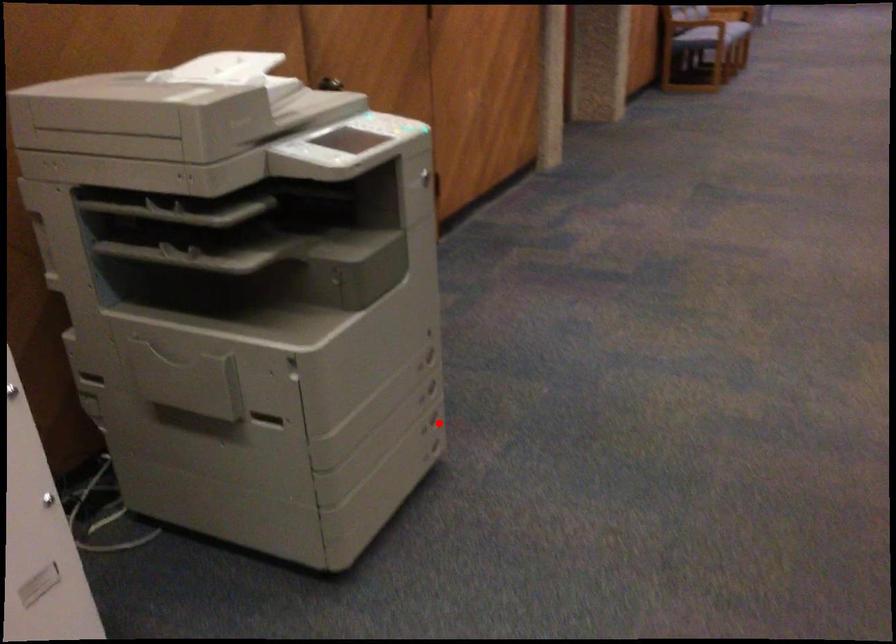
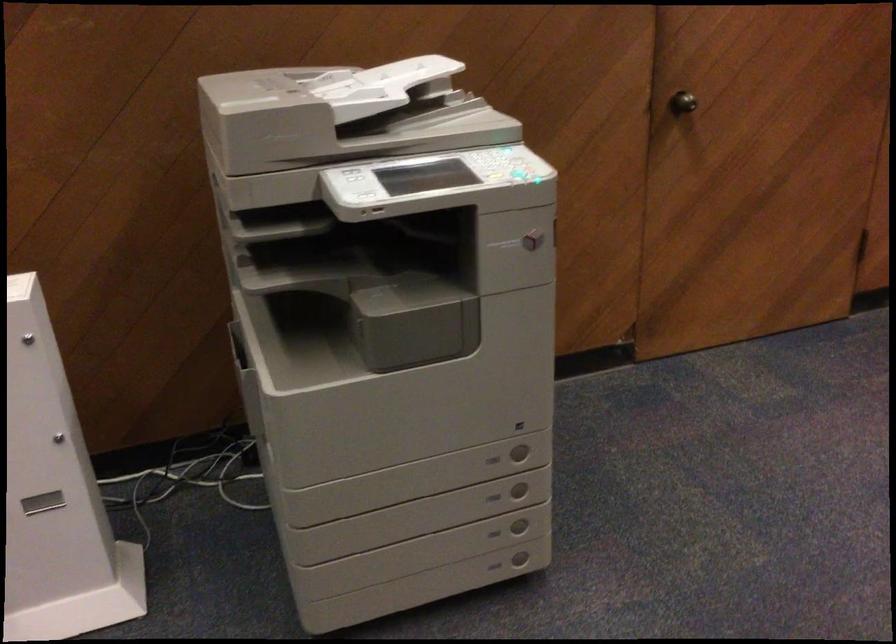
Question: I am providing you with two images of the same scene from different viewpoints. Given a red point in image1, look at the same physical point in image2. Is it:

Choices:
 (A) Closer to the viewpoint
 (B) Farther from the viewpoint

Answer: (A)